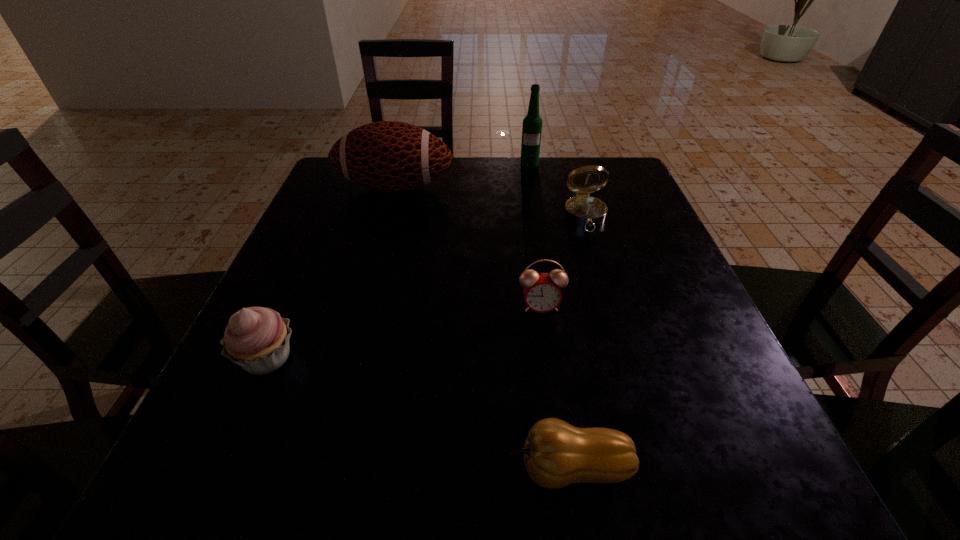
In the image, there is a desktop. What are the coordinates of `vacant space at the near right corner` in the screenshot? It's located at (727, 482).

Find the location of a particular element. This screenshot has width=960, height=540. free space between the compass and the football is located at coordinates (490, 202).

This screenshot has height=540, width=960. Identify the location of unoccupied area between the gourd and the farthest object. (549, 316).

You are a GUI agent. You are given a task and a screenshot of the screen. Output one action in this format:
    pyautogui.click(x=<x>, y=<y>)
    Task: Click on the free space that is in between the farthest object and the gourd
    
    Given the screenshot: What is the action you would take?
    pyautogui.click(x=549, y=316)

This screenshot has height=540, width=960. What are the coordinates of `empty space that is in between the alarm clock and the farthest object` in the screenshot? It's located at (535, 235).

What are the coordinates of `unoccupied area between the beer bottle and the alarm clock` in the screenshot? It's located at (535, 235).

At what (x,y) coordinates should I click in order to perform the action: click on vacant area that lies between the football and the alarm clock. Please return your answer as a coordinate pair (x, y). Looking at the image, I should click on (468, 247).

Image resolution: width=960 pixels, height=540 pixels. I want to click on empty space between the compass and the second nearest object, so click(x=426, y=287).

Image resolution: width=960 pixels, height=540 pixels. I want to click on empty space between the gourd and the compass, so click(577, 342).

Find the location of a particular element. This screenshot has width=960, height=540. blank region between the fifth shortest object and the compass is located at coordinates (490, 202).